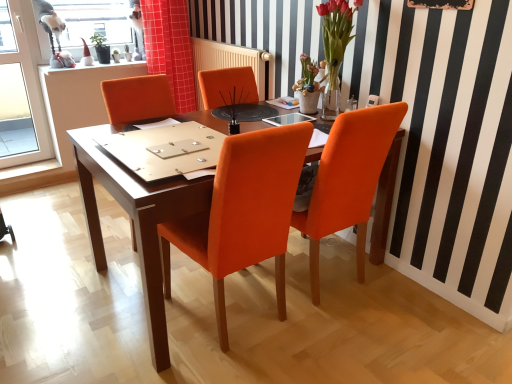
The image size is (512, 384). What do you see at coordinates (348, 181) in the screenshot?
I see `orange leather chair at center, which appears as the second chair when viewed from the left` at bounding box center [348, 181].

What do you see at coordinates (288, 119) in the screenshot? The image size is (512, 384). I see `transparent glass table at center` at bounding box center [288, 119].

Describe the element at coordinates (243, 212) in the screenshot. I see `orange leather chair at center, which is the 1th chair from left to right` at that location.

Image resolution: width=512 pixels, height=384 pixels. Describe the element at coordinates (335, 48) in the screenshot. I see `translucent glass vase at upper right` at that location.

Measure the distance between matte wood desk at center and camera.

A distance of 4.55 feet exists between matte wood desk at center and camera.

The height and width of the screenshot is (384, 512). In order to click on matte wood desk at center in this screenshot , I will do `click(136, 219)`.

Locate an element on the screen. Image resolution: width=512 pixels, height=384 pixels. red checkered fabric at upper center is located at coordinates coord(170,48).

Is wooden bulletin board at upper center smaller than orange leather chair at center, which appears as the second chair when viewed from the left?

Correct, wooden bulletin board at upper center occupies less space than orange leather chair at center, which appears as the second chair when viewed from the left.

Is wooden bulletin board at upper center positioned with its back to orange leather chair at center, which is the 1th chair from right to left?

No.

From the image's perspective, count 1st chairs downward from the wooden bulletin board at upper center and point to it. Please provide its 2D coordinates.

[(348, 181)]

Can you confirm if matte wood desk at center is thinner than orange leather chair at center, which is the 1th chair from left to right?

No, matte wood desk at center is not thinner than orange leather chair at center, which is the 1th chair from left to right.

Between matte wood desk at center and orange leather chair at center, which is the 1th chair from left to right, which one appears on the left side from the viewer's perspective?

orange leather chair at center, which is the 1th chair from left to right, is more to the left.

Is matte wood desk at center taller than orange leather chair at center, which ranks as the 2th chair in right-to-left order?

In fact, matte wood desk at center may be shorter than orange leather chair at center, which ranks as the 2th chair in right-to-left order.

Considering the sizes of matte wood desk at center and wooden bulletin board at upper center in the image, is matte wood desk at center wider or thinner than wooden bulletin board at upper center?

Clearly, matte wood desk at center has more width compared to wooden bulletin board at upper center.

What are the coordinates of `desk below the wooden bulletin board at upper center (from the image's perspective)` in the screenshot? It's located at (136, 219).

Between matte wood desk at center and wooden bulletin board at upper center, which one has larger size?

matte wood desk at center.

From a real-world perspective, which is physically below, matte wood desk at center or wooden bulletin board at upper center?

From a 3D spatial view, matte wood desk at center is below.

Relative to translucent glass vase at upper right, is red checkered fabric at upper center in front or behind?

Clearly, red checkered fabric at upper center is behind translucent glass vase at upper right.

Can you tell me how much red checkered fabric at upper center and translucent glass vase at upper right differ in facing direction?

91 degrees.

Is there a large distance between red checkered fabric at upper center and translucent glass vase at upper right?

Indeed, red checkered fabric at upper center is not near translucent glass vase at upper right.

From the image's perspective, is red checkered fabric at upper center positioned above or below translucent glass vase at upper right?

red checkered fabric at upper center is situated higher than translucent glass vase at upper right in the image.

From a real-world perspective, who is located lower, transparent glass table at center or orange leather chair at center, which ranks as the 2th chair in right-to-left order?

In real-world perspective, orange leather chair at center, which ranks as the 2th chair in right-to-left order, is lower.

Where is `the 2nd chair positioned below the transparent glass table at center (from a real-world perspective)`? This screenshot has width=512, height=384. the 2nd chair positioned below the transparent glass table at center (from a real-world perspective) is located at coordinates (243, 212).

Is transparent glass table at center behind orange leather chair at center, which is the 1th chair from left to right?

Yes, it is.

In the scene shown: Considering the sizes of transparent glass table at center and orange leather chair at center, which ranks as the 2th chair in right-to-left order, in the image, is transparent glass table at center wider or thinner than orange leather chair at center, which ranks as the 2th chair in right-to-left order,?

In the image, transparent glass table at center appears to be more narrow than orange leather chair at center, which ranks as the 2th chair in right-to-left order.

Does translucent glass vase at upper right have a lesser height compared to orange leather chair at center, which is the 1th chair from left to right?

Correct, translucent glass vase at upper right is not as tall as orange leather chair at center, which is the 1th chair from left to right.

Looking at this image, is translucent glass vase at upper right positioned with its back to orange leather chair at center, which ranks as the 2th chair in right-to-left order?

translucent glass vase at upper right is not turned away from orange leather chair at center, which ranks as the 2th chair in right-to-left order.

Is translucent glass vase at upper right wider than orange leather chair at center, which ranks as the 2th chair in right-to-left order?

No.

Does translucent glass vase at upper right come behind orange leather chair at center, which ranks as the 2th chair in right-to-left order?

That is True.

Does matte wood desk at center have a greater width compared to translucent glass vase at upper right?

Correct, the width of matte wood desk at center exceeds that of translucent glass vase at upper right.

Which is more to the left, matte wood desk at center or translucent glass vase at upper right?

From the viewer's perspective, matte wood desk at center appears more on the left side.

Measure the distance between matte wood desk at center and translucent glass vase at upper right.

→ matte wood desk at center is 3.80 feet from translucent glass vase at upper right.

This screenshot has height=384, width=512. Identify the location of floral arrangement on the right side of matte wood desk at center. (335, 48).

In the image, there is a orange leather chair at center, which appears as the second chair when viewed from the left. Where is `bulletin board above it (from the image's perspective)`? The width and height of the screenshot is (512, 384). bulletin board above it (from the image's perspective) is located at coordinates (442, 4).

I want to click on desk that is on the right side of orange leather chair at center, which ranks as the 2th chair in right-to-left order, so click(x=136, y=219).

Which object lies nearer to the anchor point orange leather chair at center, which is the 1th chair from left to right, wooden bulletin board at upper center or translucent glass vase at upper right?

translucent glass vase at upper right is closer to orange leather chair at center, which is the 1th chair from left to right.

Based on their spatial positions, is wooden bulletin board at upper center or matte wood desk at center further from red checkered fabric at upper center?

Based on the image, wooden bulletin board at upper center appears to be further to red checkered fabric at upper center.

Based on their spatial positions, is transparent glass table at center or red checkered fabric at upper center closer to wooden bulletin board at upper center?

transparent glass table at center.

Based on their spatial positions, is transparent glass table at center or orange leather chair at center, which is the 1th chair from left to right, further from matte wood desk at center?

Among the two, transparent glass table at center is located further to matte wood desk at center.

Estimate the real-world distances between objects in this image. Which object is further from translucent glass vase at upper right, red checkered fabric at upper center or matte wood desk at center?

The object further to translucent glass vase at upper right is red checkered fabric at upper center.

Estimate the real-world distances between objects in this image. Which object is closer to orange leather chair at center, which appears as the second chair when viewed from the left, matte wood desk at center or transparent glass table at center?

transparent glass table at center is positioned closer to the anchor orange leather chair at center, which appears as the second chair when viewed from the left.

Consider the image. Considering their positions, is orange leather chair at center, which is the 1th chair from left to right, positioned closer to wooden bulletin board at upper center than orange leather chair at center, which is the 1th chair from right to left?

Among the two, orange leather chair at center, which is the 1th chair from right to left, is located nearer to wooden bulletin board at upper center.

Based on their spatial positions, is transparent glass table at center or orange leather chair at center, which is the 1th chair from left to right, further from orange leather chair at center, which appears as the second chair when viewed from the left?

transparent glass table at center is further to orange leather chair at center, which appears as the second chair when viewed from the left.

Locate an element on the screen. This screenshot has width=512, height=384. floral arrangement between wooden bulletin board at upper center and matte wood desk at center vertically is located at coordinates (335, 48).

Where is `floral arrangement located between red checkered fabric at upper center and wooden bulletin board at upper center in the left-right direction`? The height and width of the screenshot is (384, 512). floral arrangement located between red checkered fabric at upper center and wooden bulletin board at upper center in the left-right direction is located at coordinates click(x=335, y=48).

I want to click on floral arrangement located between orange leather chair at center, which is the 1th chair from left to right, and red checkered fabric at upper center in the depth direction, so click(335, 48).

Find the location of a particular element. Image resolution: width=512 pixels, height=384 pixels. floral arrangement between orange leather chair at center, which ranks as the 2th chair in right-to-left order, and transparent glass table at center, along the z-axis is located at coordinates (335, 48).